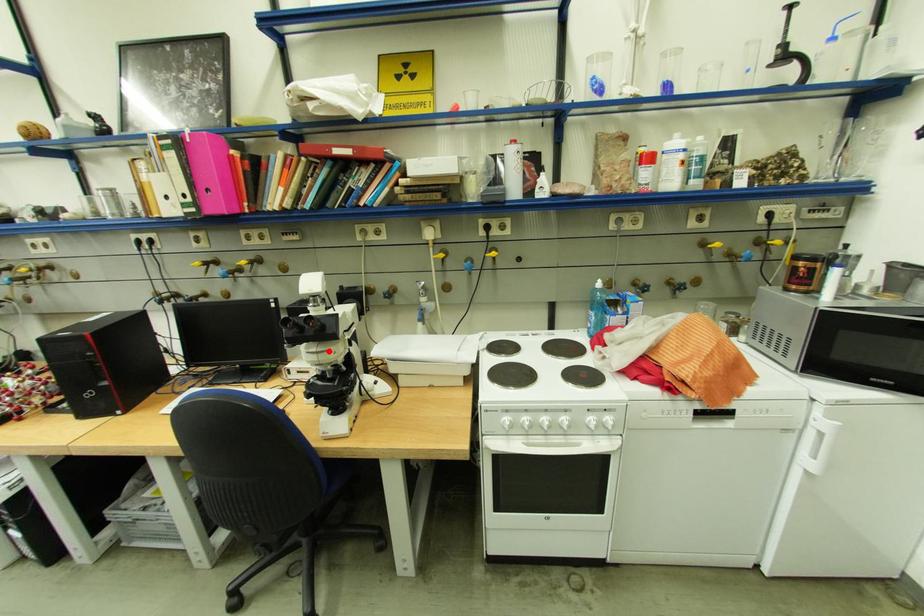
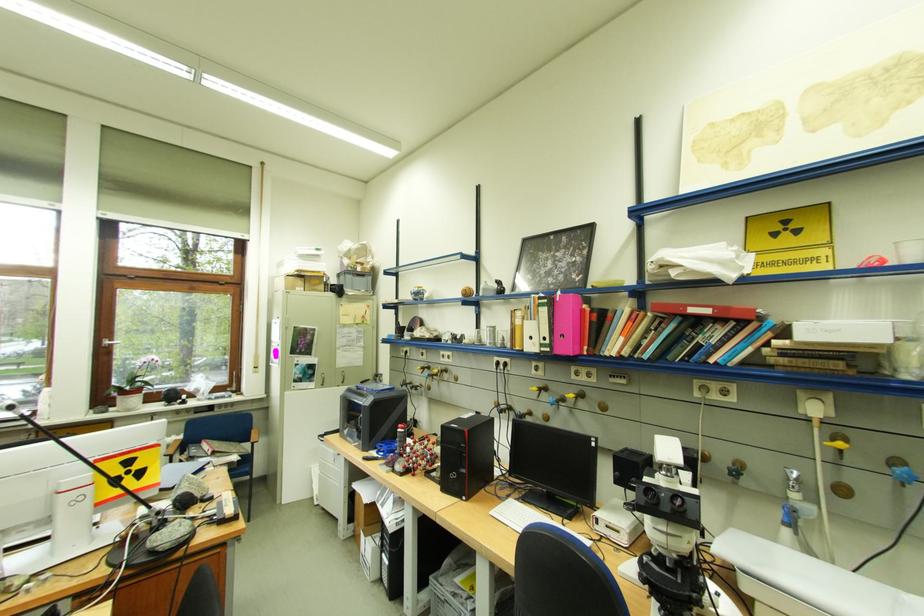
The point at the highlighted location is marked in the first image. Where is the corresponding point in the second image?

(681, 533)